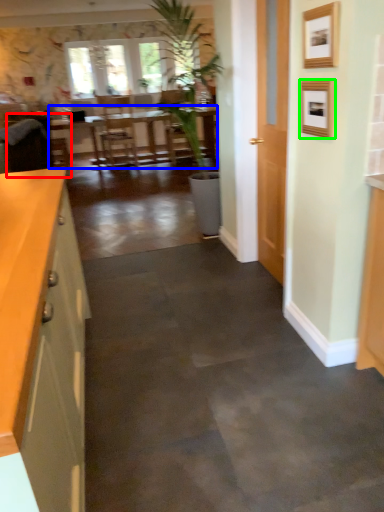
Question: Which object is the farthest from armchair (highlighted by a red box)? Choose among these: table (highlighted by a blue box) or picture frame (highlighted by a green box).

Choices:
 (A) table
 (B) picture frame

Answer: (A)